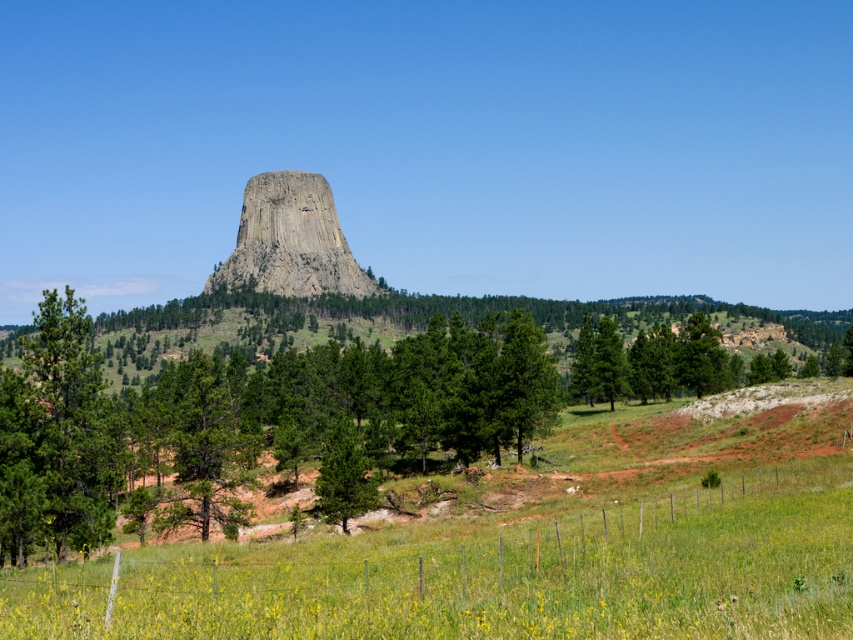
Can you confirm if green matte tree at left is positioned to the left of green rough bark tree at center?

Yes, green matte tree at left is to the left of green rough bark tree at center.

Is point (22, 381) farther from viewer compared to point (334, 449)?

No, it is not.

Between point (39, 422) and point (335, 493), which one is positioned behind?

Positioned behind is point (335, 493).

Where is `green matte tree at left`? The height and width of the screenshot is (640, 853). green matte tree at left is located at coordinates (56, 436).

What do you see at coordinates (56, 436) in the screenshot? The width and height of the screenshot is (853, 640). I see `green matte tree at left` at bounding box center [56, 436].

Which is behind, point (6, 452) or point (279, 269)?

Point (279, 269)

The image size is (853, 640). What are the coordinates of `green matte tree at left` in the screenshot? It's located at (56, 436).

Does point (355, 291) come behind point (341, 490)?

Yes, it is behind point (341, 490).

The height and width of the screenshot is (640, 853). Describe the element at coordinates (289, 241) in the screenshot. I see `granite rock formation at center` at that location.

Identify the location of granite rock formation at center. (289, 241).